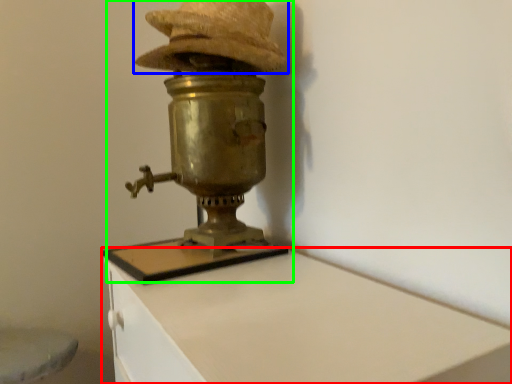
Question: Considering the real-world distances, which object is farthest from furniture (highlighted by a red box)? hat (highlighted by a blue box) or table lamp (highlighted by a green box)?

Choices:
 (A) hat
 (B) table lamp

Answer: (A)